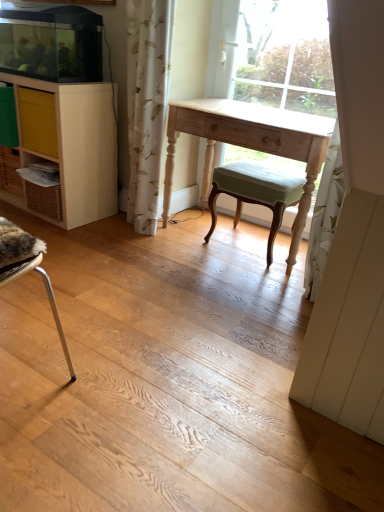
Identify the location of unoccupied area in front of light wood desk at center. The height and width of the screenshot is (512, 384). (215, 291).